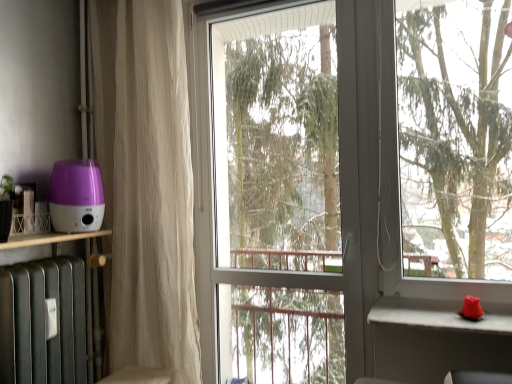
Locate an element on the screen. Image resolution: width=512 pixels, height=384 pixels. purple plastic humidifier at left is located at coordinates (76, 196).

At what (x,y) coordinates should I click in order to perform the action: click on white concrete window sill at right. Please return your answer as a coordinate pair (x, y). Looking at the image, I should click on (440, 315).

Where is `curtain above the white concrete window sill at right (from a real-world perspective)`? curtain above the white concrete window sill at right (from a real-world perspective) is located at coordinates (146, 183).

Visually, is white concrete window sill at right positioned to the left or to the right of white sheer curtain at left?

white concrete window sill at right is positioned on white sheer curtain at left's right side.

From a real-world perspective, between white concrete window sill at right and white sheer curtain at left, who is vertically higher?

white sheer curtain at left is physically above.

Does purple plastic humidifier at left lie in front of white concrete window sill at right?

No.

Which is in front, point (98, 218) or point (456, 314)?

The point (456, 314) is in front.

Is purple plastic humidifier at left facing towards white concrete window sill at right?

Yes, purple plastic humidifier at left is aimed at white concrete window sill at right.

Is purple plastic humidifier at left aimed at transparent glass screen door at center?

No, purple plastic humidifier at left is not aimed at transparent glass screen door at center.

From the picture: Are purple plastic humidifier at left and transparent glass screen door at center located far from each other?

Absolutely, purple plastic humidifier at left is distant from transparent glass screen door at center.

Relative to transparent glass screen door at center, is purple plastic humidifier at left in front or behind?

purple plastic humidifier at left is positioned closer to the viewer than transparent glass screen door at center.

Does purple plastic humidifier at left have a greater height compared to transparent glass screen door at center?

In fact, purple plastic humidifier at left may be shorter than transparent glass screen door at center.

From the image's perspective, is white concrete window sill at right positioned above or below transparent glass screen door at center?

white concrete window sill at right is below transparent glass screen door at center.

From a real-world perspective, which is physically below, white concrete window sill at right or transparent glass screen door at center?

From a 3D spatial view, white concrete window sill at right is below.

Is white concrete window sill at right at the left side of transparent glass screen door at center?

In fact, white concrete window sill at right is to the right of transparent glass screen door at center.

From the image's perspective, is white sheer curtain at left beneath white concrete window sill at right?

No, from the image's perspective, white sheer curtain at left is not beneath white concrete window sill at right.

Is white concrete window sill at right at the back of white sheer curtain at left?

That's not correct — white sheer curtain at left is not looking away from white concrete window sill at right.

Is white sheer curtain at left wider or thinner than white concrete window sill at right?

white sheer curtain at left is thinner than white concrete window sill at right.

From a real-world perspective, is white sheer curtain at left physically below white concrete window sill at right?

Actually, white sheer curtain at left is physically above white concrete window sill at right in the real world.

Can you confirm if white sheer curtain at left is positioned to the right of transparent glass screen door at center?

In fact, white sheer curtain at left is to the left of transparent glass screen door at center.

Is transparent glass screen door at center at the back of white sheer curtain at left?

white sheer curtain at left is not turned away from transparent glass screen door at center.

Does point (130, 235) come behind point (272, 285)?

Yes.

Measure the distance between white sheer curtain at left and transparent glass screen door at center.

white sheer curtain at left is 1.49 meters from transparent glass screen door at center.

Is white sheer curtain at left with purple plastic humidifier at left?

white sheer curtain at left and purple plastic humidifier at left are clearly separated.

You are a GUI agent. You are given a task and a screenshot of the screen. Output one action in this format:
    pyautogui.click(x=<x>, y=<y>)
    Task: Click on the appliance in front of the white sheer curtain at left
    
    Given the screenshot: What is the action you would take?
    pyautogui.click(x=76, y=196)

In terms of size, does white sheer curtain at left appear bigger or smaller than purple plastic humidifier at left?

Clearly, white sheer curtain at left is larger in size than purple plastic humidifier at left.

Is white sheer curtain at left further to camera compared to purple plastic humidifier at left?

Yes, it is behind purple plastic humidifier at left.

Where is `curtain behind the white concrete window sill at right`? curtain behind the white concrete window sill at right is located at coordinates pyautogui.click(x=146, y=183).

The width and height of the screenshot is (512, 384). I want to click on appliance on the left of white concrete window sill at right, so click(76, 196).

Considering their positions, is purple plastic humidifier at left positioned closer to transparent glass screen door at center than white concrete window sill at right?

Based on the image, purple plastic humidifier at left appears to be nearer to transparent glass screen door at center.

When comparing their distances from purple plastic humidifier at left, does white sheer curtain at left or transparent glass screen door at center seem further?

transparent glass screen door at center is positioned further to the anchor purple plastic humidifier at left.

From the image, which object appears to be nearer to white concrete window sill at right, white sheer curtain at left or purple plastic humidifier at left?

white sheer curtain at left.

Estimate the real-world distances between objects in this image. Which object is further from purple plastic humidifier at left, white concrete window sill at right or white sheer curtain at left?

white concrete window sill at right is further to purple plastic humidifier at left.

When comparing their distances from white sheer curtain at left, does transparent glass screen door at center or purple plastic humidifier at left seem closer?

Based on the image, purple plastic humidifier at left appears to be nearer to white sheer curtain at left.

From the image, which object appears to be farther from transparent glass screen door at center, white sheer curtain at left or purple plastic humidifier at left?

Based on the image, purple plastic humidifier at left appears to be further to transparent glass screen door at center.

Which object lies further to the anchor point white concrete window sill at right, transparent glass screen door at center or white sheer curtain at left?

transparent glass screen door at center is further to white concrete window sill at right.

When comparing their distances from white sheer curtain at left, does white concrete window sill at right or purple plastic humidifier at left seem further?

white concrete window sill at right is positioned further to the anchor white sheer curtain at left.

What are the coordinates of `screen door between white sheer curtain at left and white concrete window sill at right` in the screenshot? It's located at (280, 191).

The width and height of the screenshot is (512, 384). I want to click on screen door between purple plastic humidifier at left and white concrete window sill at right from left to right, so click(x=280, y=191).

The height and width of the screenshot is (384, 512). In order to click on curtain between purple plastic humidifier at left and transparent glass screen door at center in this screenshot , I will do `click(146, 183)`.

Image resolution: width=512 pixels, height=384 pixels. Find the location of `curtain between purple plastic humidifier at left and white concrete window sill at right from left to right`. curtain between purple plastic humidifier at left and white concrete window sill at right from left to right is located at coordinates (146, 183).